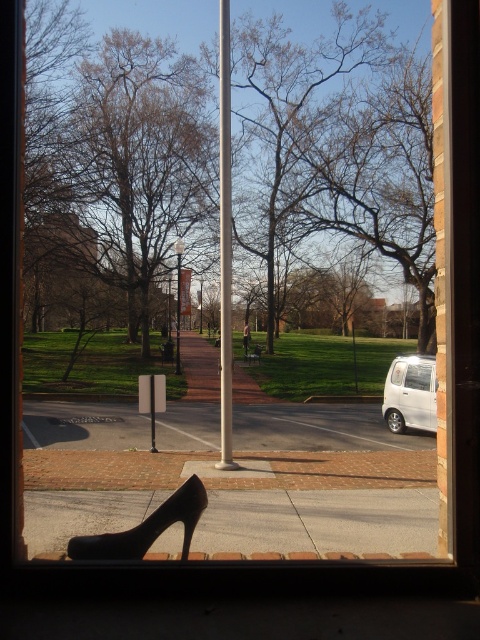
Who is higher up, smooth silver pole at center or white matte car at lower right?

smooth silver pole at center is higher up.

Which of these two, smooth silver pole at center or white matte car at lower right, stands shorter?

white matte car at lower right

The image size is (480, 640). What do you see at coordinates (225, 241) in the screenshot? I see `smooth silver pole at center` at bounding box center [225, 241].

Where is `smooth silver pole at center`? Image resolution: width=480 pixels, height=640 pixels. smooth silver pole at center is located at coordinates (225, 241).

How far apart are black leather high heel at lower left and white matte car at lower right?

They are 42.68 feet apart.

From the picture: Which of these two, black leather high heel at lower left or white matte car at lower right, stands taller?

white matte car at lower right is taller.

Is point (113, 557) closer to camera compared to point (392, 388)?

Yes, it is in front of point (392, 388).

What are the coordinates of `black leather high heel at lower left` in the screenshot? It's located at (145, 528).

Between point (228, 150) and point (100, 552), which one is positioned in front?

Point (100, 552) is in front.

Measure the distance between smooth silver pole at center and camera.

8.78 meters

This screenshot has height=640, width=480. Find the location of `smooth silver pole at center`. smooth silver pole at center is located at coordinates (225, 241).